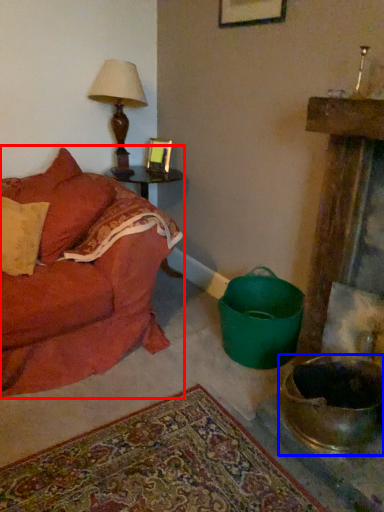
Question: Which object is closer to the camera taking this photo, studio couch (highlighted by a red box) or mixing bowl (highlighted by a blue box)?

Choices:
 (A) studio couch
 (B) mixing bowl

Answer: (B)